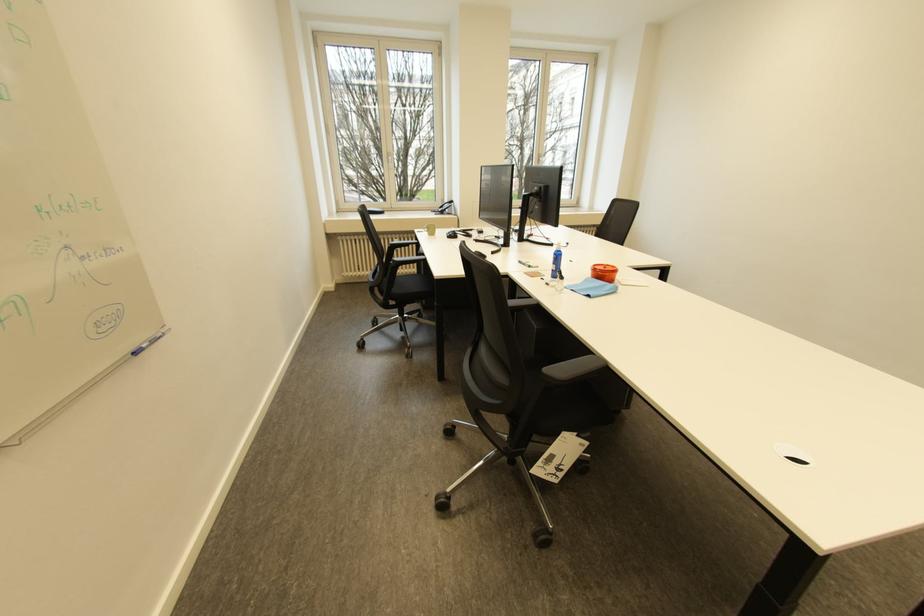
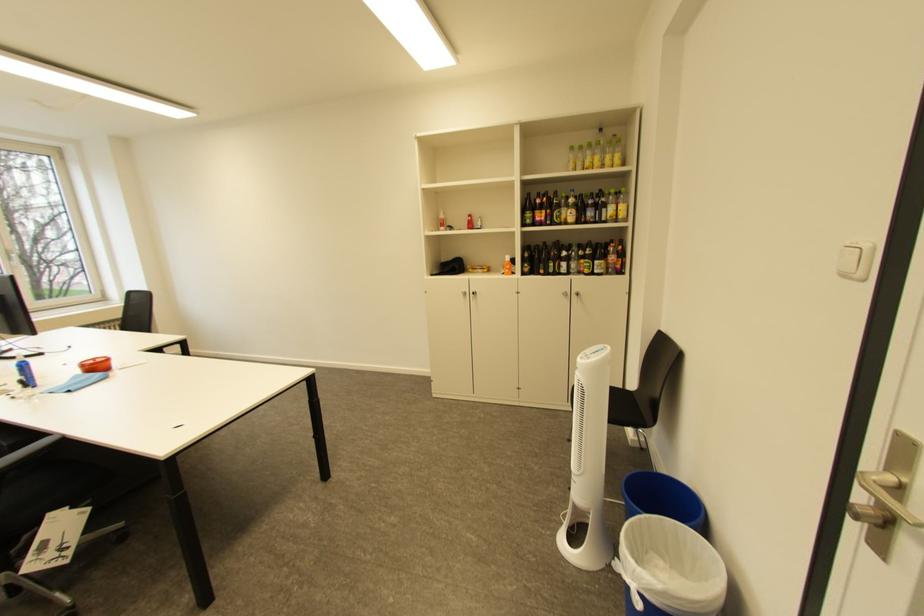
Where in the second image is the point corresponding to (618,270) from the first image?

(108, 362)